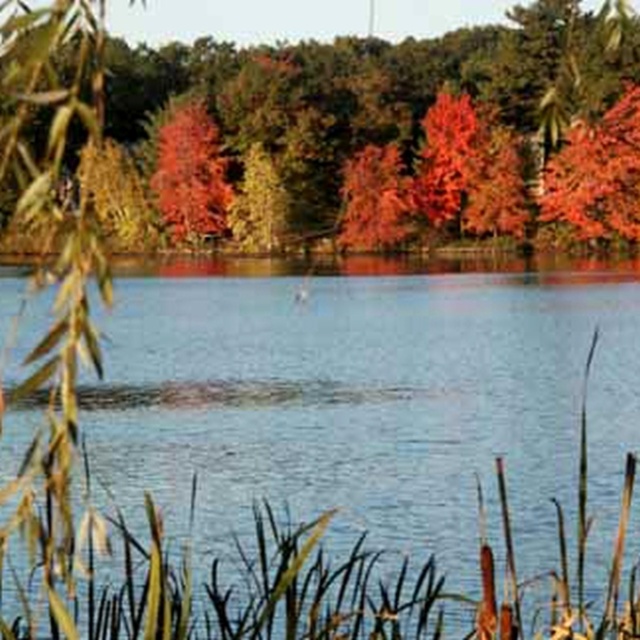
You are standing at the lakeside and want to pick up the autumn leaves at upper center. Which direction should you move relative to the clear water at center?

The clear water at center is located below the autumn leaves at upper center, so you should move upwards or towards the top of the scene to reach the autumn leaves at upper center.